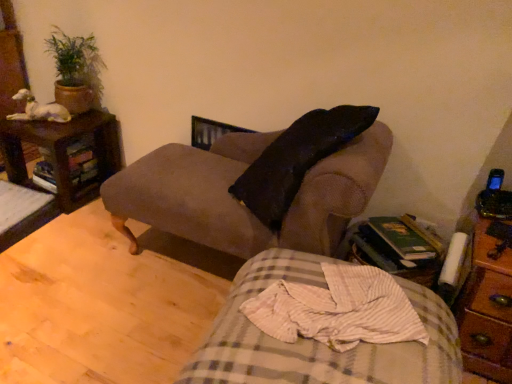
Where is `blank space situated above brown wooden nightstand at left, placed as the first nightstand when sorted from left to right (from a real-world perspective)`? The width and height of the screenshot is (512, 384). blank space situated above brown wooden nightstand at left, placed as the first nightstand when sorted from left to right (from a real-world perspective) is located at coordinates (64, 123).